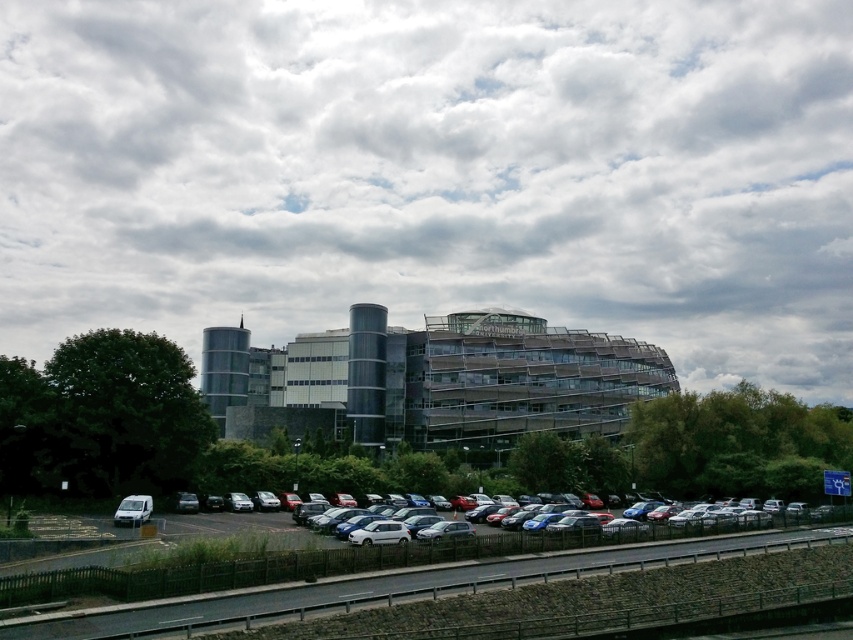
Question: Estimate the real-world distances between objects in this image. Which object is closer to the white matte van at lower left?

Choices:
 (A) dark asphalt highway at lower center
 (B) metallic silver car at center

Answer: (B)

Question: Which of the following is the closest to the observer?

Choices:
 (A) (289, 520)
 (B) (490, 572)
 (C) (140, 515)
 (D) (96, 198)

Answer: (B)

Question: Can you confirm if cloudy sky at upper center is thinner than white matte van at lower left?

Choices:
 (A) yes
 (B) no

Answer: (B)

Question: Is cloudy sky at upper center closer to camera compared to metallic silver car at center?

Choices:
 (A) no
 (B) yes

Answer: (A)

Question: Among these points, which one is farthest from the camera?

Choices:
 (A) (102, 196)
 (B) (90, 625)
 (C) (128, 502)

Answer: (A)

Question: Can you confirm if cloudy sky at upper center is positioned below metallic silver car at center?

Choices:
 (A) yes
 (B) no

Answer: (B)